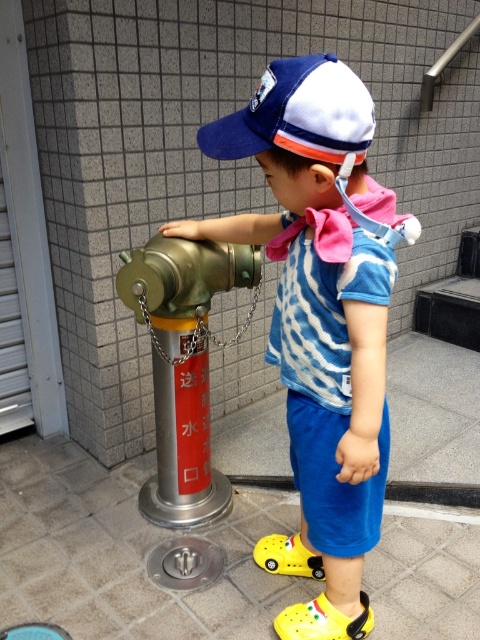
You are a delivery robot with a width of 20 inches. You need to pass between the blue cotton shirt at center and the metallic hydrant at center. Can you fit through the space between them?

The distance between the blue cotton shirt at center and the metallic hydrant at center is 16.52 inches. Since the robot is 20 inches wide, it cannot fit through the space between them.

In the scene, there is a young child wearing a blue and white striped shirt, blue shorts, yellow Crocs with a car design, and a navy blue baseball cap with a white front panel and orange trim. The child has a pink scarf and a light blue strap attached to the back of their cap. The child is near a metallic fire hydrant that is silver and red with chains and Chinese characters on the red section. The fire hydrant is located at point (321,320). Which object is at the specified coordinate point?

The blue cotton shirt at center is located at point (321,320).